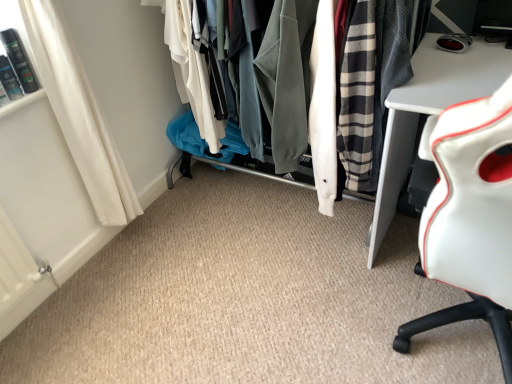
Question: From a real-world perspective, is textured fabric clothes at center positioned above or below white leather chair at right?

Choices:
 (A) above
 (B) below

Answer: (B)

Question: In the image, is textured fabric clothes at center positioned in front of or behind white leather chair at right?

Choices:
 (A) behind
 (B) front

Answer: (A)

Question: Which object is positioned farthest from the white leather chair at right?

Choices:
 (A) textured fabric clothes at center
 (B) white fabric curtain at lower left

Answer: (B)

Question: Which object is the closest to the white fabric curtain at lower left?

Choices:
 (A) white leather chair at right
 (B) textured fabric clothes at center

Answer: (B)